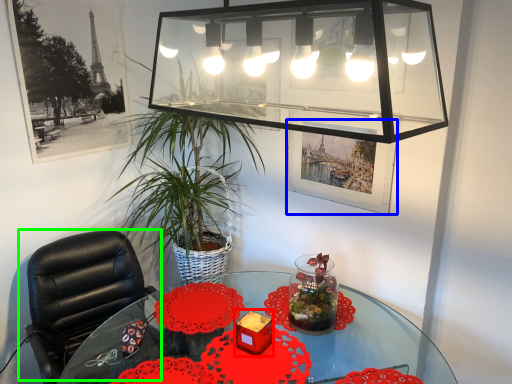
Question: Estimate the real-world distances between objects in this image. Which object is closer to candle holder (highlighted by a red box), picture frame (highlighted by a blue box) or chair (highlighted by a green box)?

Choices:
 (A) picture frame
 (B) chair

Answer: (A)